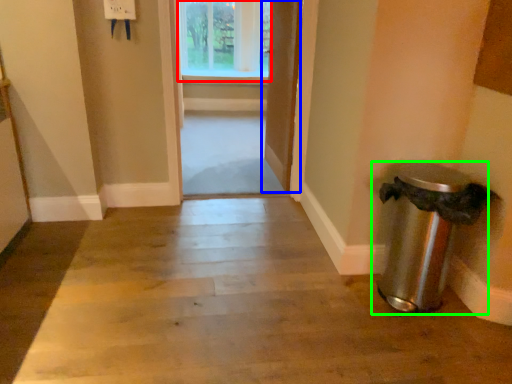
Question: Estimate the real-world distances between objects in this image. Which object is closer to window (highlighted by a red box), door (highlighted by a blue box) or waste container (highlighted by a green box)?

Choices:
 (A) door
 (B) waste container

Answer: (A)